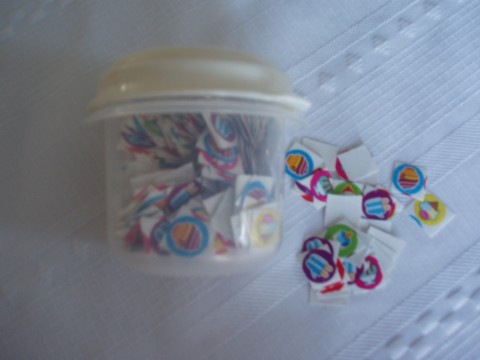
Where is `handle on cup lid`? This screenshot has height=360, width=480. handle on cup lid is located at coordinates (293, 100).